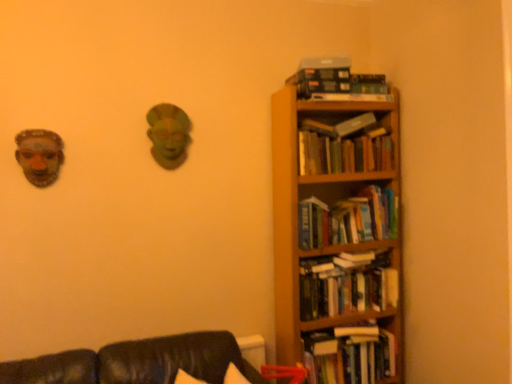
Question: From the image's perspective, is hardcover book at upper right over hardcover books at right, acting as the fourth book starting from the top?

Choices:
 (A) yes
 (B) no

Answer: (A)

Question: Considering the relative sizes of hardcover book at upper right and hardcover books at right, acting as the fourth book starting from the top, in the image provided, is hardcover book at upper right shorter than hardcover books at right, acting as the fourth book starting from the top,?

Choices:
 (A) no
 (B) yes

Answer: (B)

Question: Is hardcover book at upper right in front of hardcover books at right, which appears as the 2th book when ordered from the bottom?

Choices:
 (A) yes
 (B) no

Answer: (B)

Question: Is hardcover book at upper right touching hardcover books at right, which appears as the 2th book when ordered from the bottom?

Choices:
 (A) no
 (B) yes

Answer: (A)

Question: Is hardcover books at right, which appears as the 2th book when ordered from the bottom, inside hardcover book at upper right?

Choices:
 (A) yes
 (B) no

Answer: (B)

Question: From a real-world perspective, is hardcover book at upper right over hardcover books at right, acting as the fourth book starting from the top?

Choices:
 (A) no
 (B) yes

Answer: (B)

Question: Can you confirm if wooden bookcase at right is taller than matte brown mask at left?

Choices:
 (A) no
 (B) yes

Answer: (B)

Question: Is wooden bookcase at right turned away from matte brown mask at left?

Choices:
 (A) no
 (B) yes

Answer: (A)

Question: Would you say matte brown mask at left is part of wooden bookcase at right's contents?

Choices:
 (A) yes
 (B) no

Answer: (B)

Question: Is wooden bookcase at right directly adjacent to matte brown mask at left?

Choices:
 (A) no
 (B) yes

Answer: (A)

Question: Is wooden bookcase at right outside of matte brown mask at left?

Choices:
 (A) no
 (B) yes

Answer: (B)

Question: Does wooden bookcase at right lie behind matte brown mask at left?

Choices:
 (A) no
 (B) yes

Answer: (B)

Question: Is hardcover books at right, the 2th book positioned from the top, aimed at hardcover book at upper right?

Choices:
 (A) no
 (B) yes

Answer: (A)